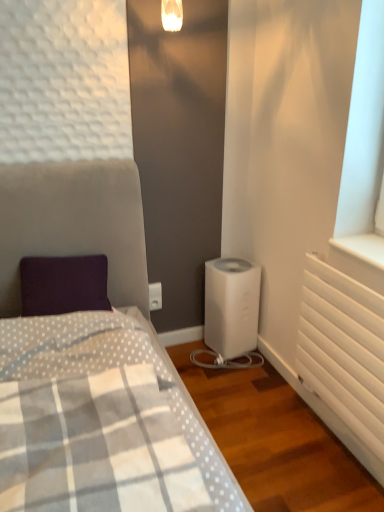
Image resolution: width=384 pixels, height=512 pixels. What are the coordinates of `empty space that is ontop of white plastic water heater at lower center (from a real-world perspective)` in the screenshot? It's located at (229, 265).